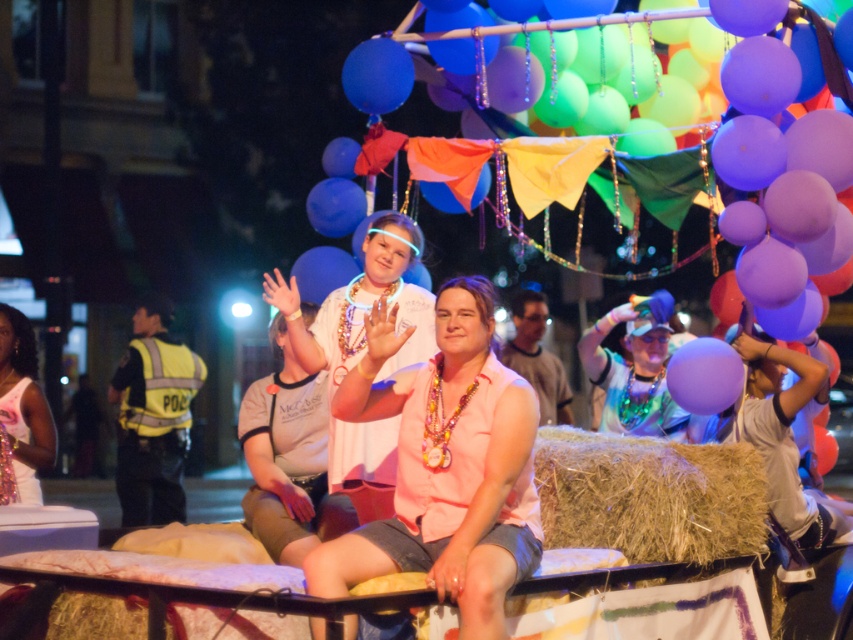
You are standing in front of the float and want to determine the relative positions of two points marked on the float. Which point is closer to you, point at position (160, 364) or point at position (715, 374)?

Point at position (160, 364) is closer to you than point at position (715, 374) because it is further to the viewer according to the description.